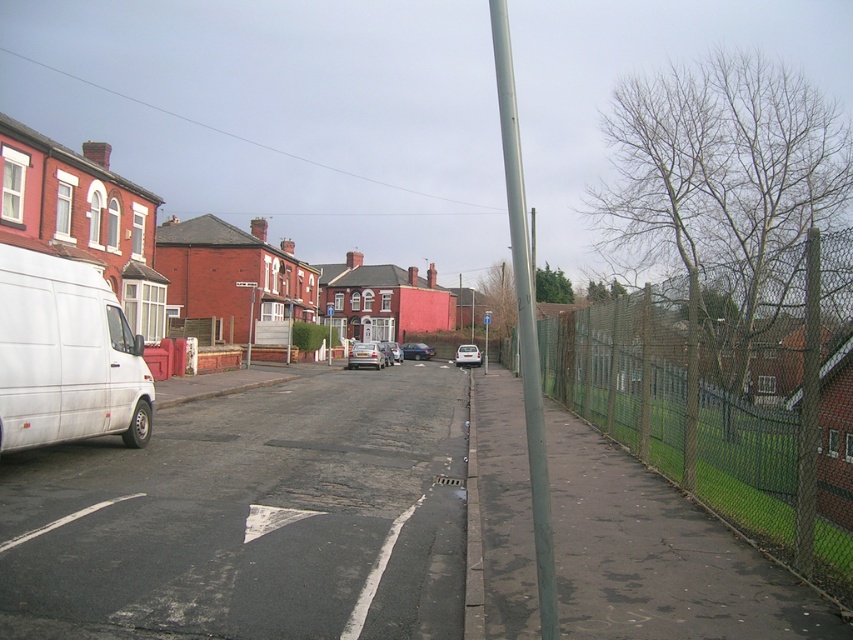
Question: Can you confirm if white matte van at left is positioned above metallic gray pole at center-right?

Choices:
 (A) yes
 (B) no

Answer: (B)

Question: Among these objects, which one is nearest to the camera?

Choices:
 (A) white matte van at left
 (B) metallic gray pole at center-right
 (C) metallic rectangular sign at center
 (D) green chain-link fence at right

Answer: (B)

Question: Does metallic gray pole at center-right have a smaller size compared to metallic pole at center?

Choices:
 (A) no
 (B) yes

Answer: (A)

Question: In this image, where is white matte van at left located relative to matte black car at center?

Choices:
 (A) left
 (B) right

Answer: (A)

Question: Which object is the farthest from the silver metallic car at center?

Choices:
 (A) white matte car at center
 (B) metallic gray pole at center-right
 (C) metallic pole at center

Answer: (B)

Question: Which object appears closest to the camera in this image?

Choices:
 (A) metallic gray pole at center-right
 (B) white matte van at left
 (C) white plastic sign at center

Answer: (A)